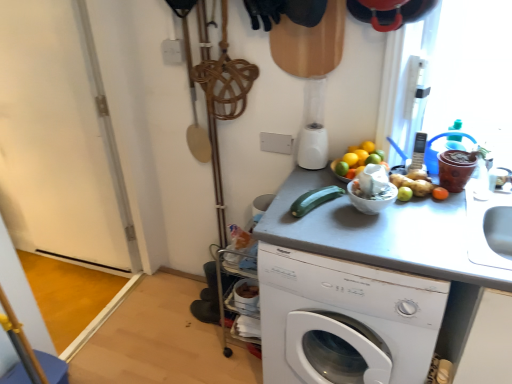
Identify the location of free space to the left of white glossy bowl at upper right. (325, 221).